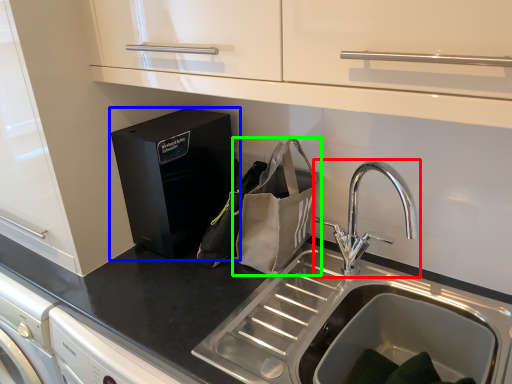
Question: Which is nearer to the tap (highlighted by a red box)? home appliance (highlighted by a blue box) or pouch (highlighted by a green box).

Choices:
 (A) home appliance
 (B) pouch

Answer: (B)